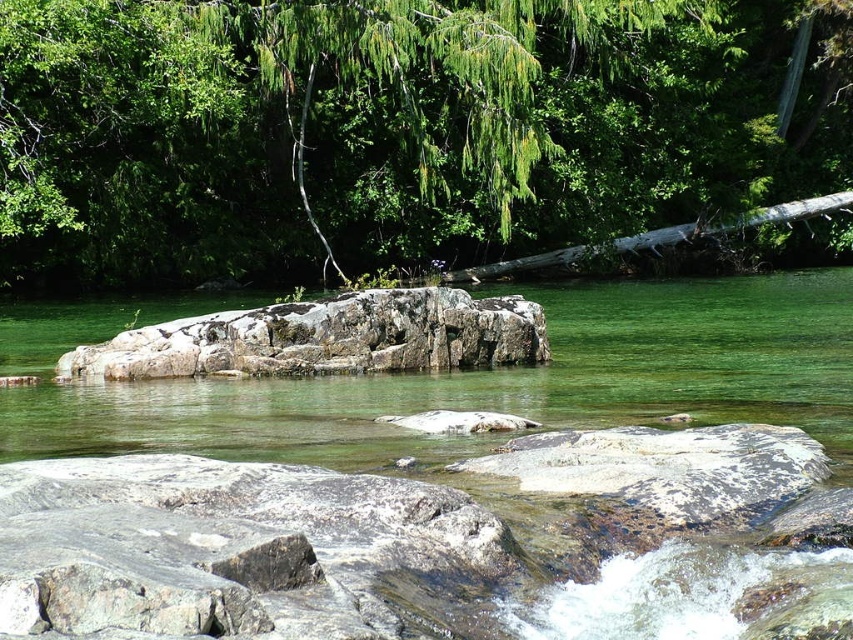
Question: Considering the relative positions of green leafy tree at upper center and gray rock at center in the image provided, where is green leafy tree at upper center located with respect to gray rock at center?

Choices:
 (A) left
 (B) right

Answer: (B)

Question: Is green leafy tree at upper center to the left of gray rock at center from the viewer's perspective?

Choices:
 (A) no
 (B) yes

Answer: (A)

Question: Which object is closer to the camera taking this photo?

Choices:
 (A) gray rock at center
 (B) green leafy tree at upper center

Answer: (A)

Question: Does green leafy tree at upper center have a smaller size compared to gray rock at center?

Choices:
 (A) no
 (B) yes

Answer: (A)